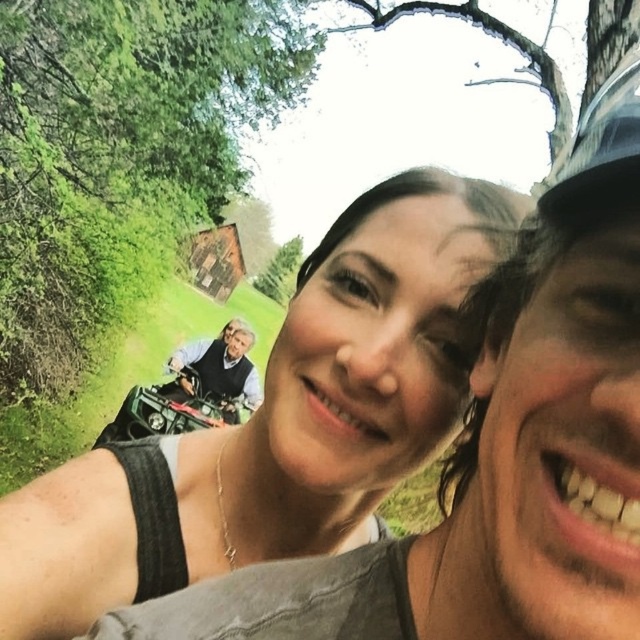
Question: Does matte black tank top at center appear on the right side of light brown leather jacket at center?

Choices:
 (A) no
 (B) yes

Answer: (B)

Question: Which point is closer to the camera taking this photo?

Choices:
 (A) (209, 371)
 (B) (289, 468)

Answer: (B)

Question: Considering the relative positions of matte black tank top at center and light brown leather jacket at center in the image provided, where is matte black tank top at center located with respect to light brown leather jacket at center?

Choices:
 (A) below
 (B) above

Answer: (B)

Question: Among these points, which one is nearest to the camera?

Choices:
 (A) (458, 179)
 (B) (161, 388)

Answer: (A)

Question: Where is matte black tank top at center located in relation to light brown leather jacket at center in the image?

Choices:
 (A) above
 (B) below

Answer: (A)